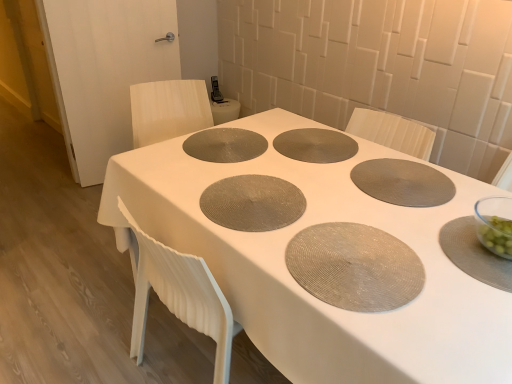
Where is `free location to the left of matte gray placemat at center, acting as the first pizza pan starting from the left`? free location to the left of matte gray placemat at center, acting as the first pizza pan starting from the left is located at coordinates (172, 179).